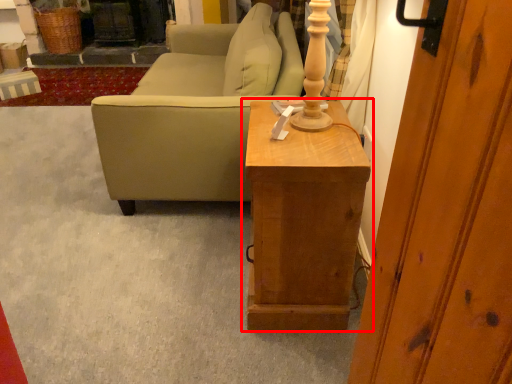
Question: From the image's perspective, where is table (annotated by the red box) located relative to studio couch?

Choices:
 (A) above
 (B) below

Answer: (B)